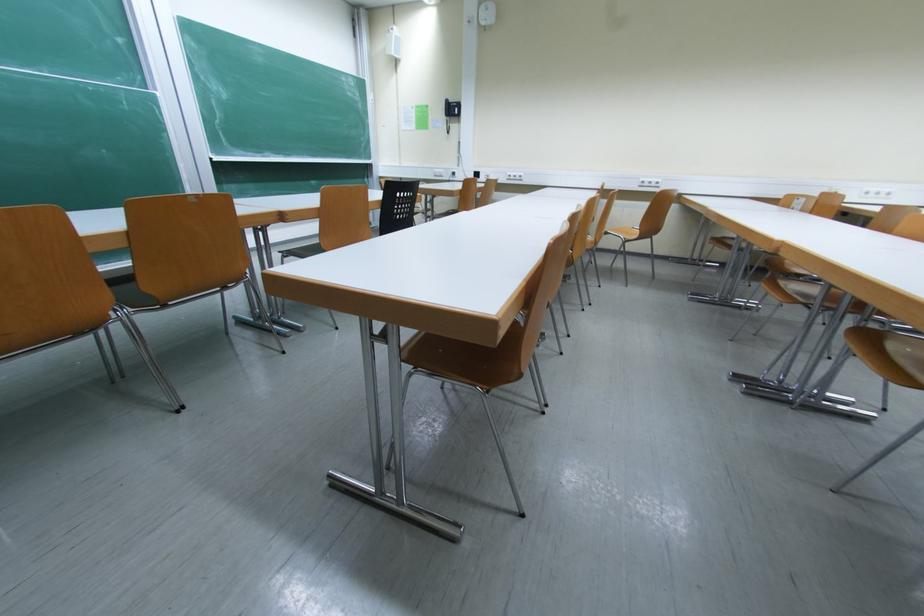
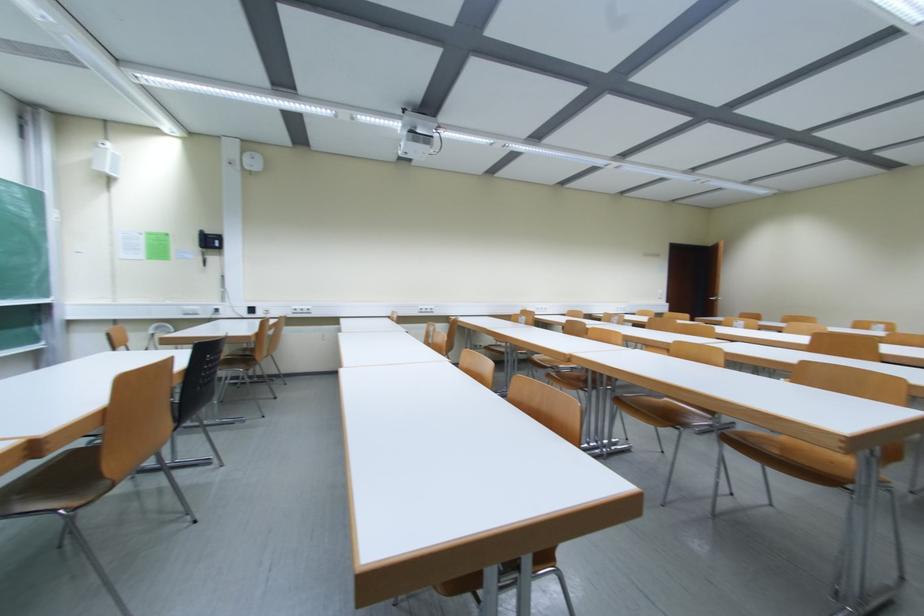
Question: Based on the continuous images, in which direction is the camera rotating? Reply with the corresponding letter.

Choices:
 (A) Left
 (B) Right
 (C) Up
 (D) Down

Answer: (B)